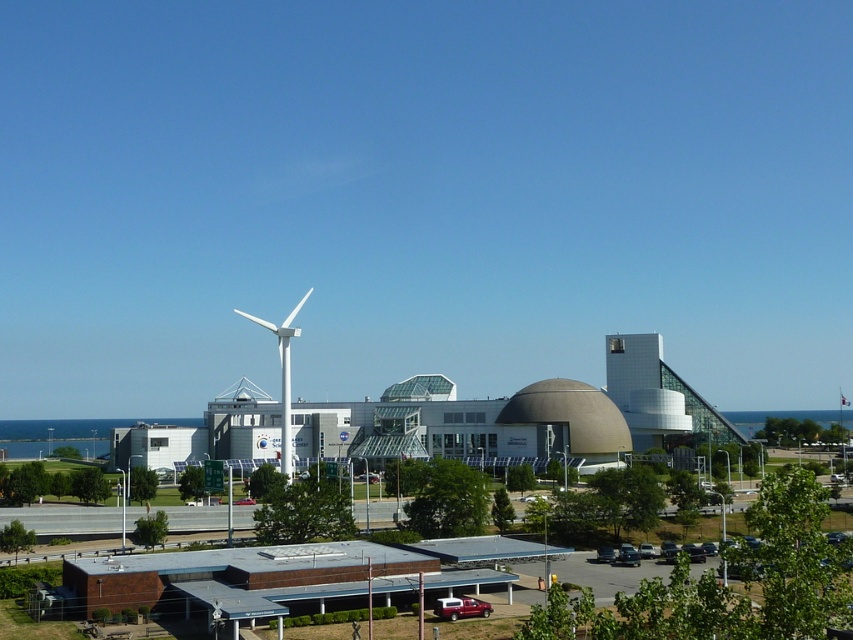
Between point (287, 348) and point (461, 618), which one is positioned behind?

Positioned behind is point (287, 348).

Who is higher up, white matte windmill at center or metallic red pickup truck at lower center?

Positioned higher is white matte windmill at center.

Between point (287, 440) and point (447, 605), which one is positioned in front?

Positioned in front is point (447, 605).

Image resolution: width=853 pixels, height=640 pixels. What are the coordinates of `white matte windmill at center` in the screenshot? It's located at (283, 378).

Is metallic red pickup truck at lower center in front of metallic silver car at center?

Yes, metallic red pickup truck at lower center is closer to the viewer.

The width and height of the screenshot is (853, 640). Find the location of `metallic red pickup truck at lower center`. metallic red pickup truck at lower center is located at coordinates (460, 608).

Who is more distant from viewer, [285,436] or [354,477]?

The point [285,436] is more distant.

What do you see at coordinates (283, 378) in the screenshot?
I see `white matte windmill at center` at bounding box center [283, 378].

At what (x,y) coordinates should I click in order to perform the action: click on white matte windmill at center. Please return your answer as a coordinate pair (x, y). Image resolution: width=853 pixels, height=640 pixels. Looking at the image, I should click on (283, 378).